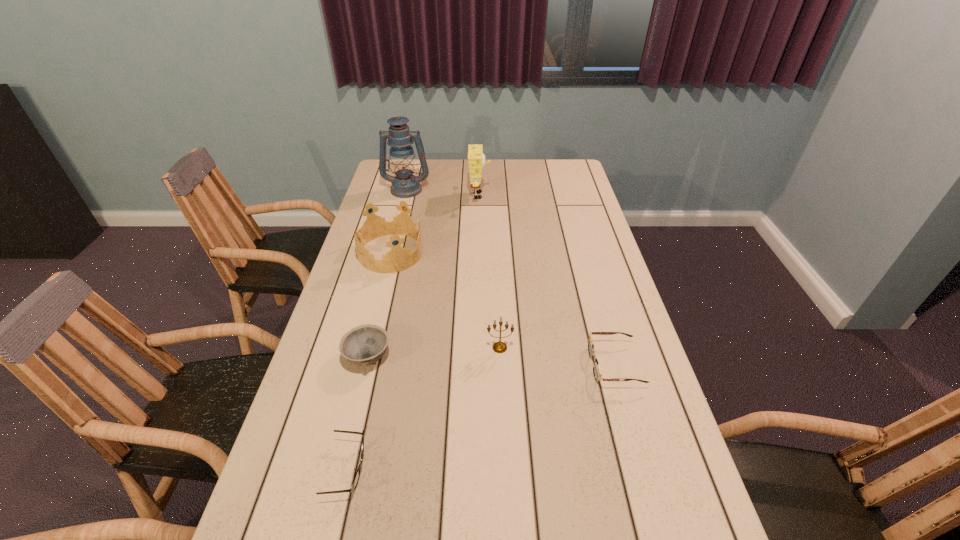
Locate an element on the screen. lantern is located at coordinates (404, 185).

Identify the location of the sixth shortest object. (476, 159).

Locate an element on the screen. The image size is (960, 540). the fifth nearest object is located at coordinates [x=398, y=258].

Locate an element on the screen. The height and width of the screenshot is (540, 960). candelabrum is located at coordinates click(499, 347).

The width and height of the screenshot is (960, 540). What are the coordinates of `the third shortest object` in the screenshot? It's located at (363, 345).

This screenshot has width=960, height=540. Find the location of `the rightmost object`. the rightmost object is located at coordinates (596, 369).

The image size is (960, 540). I want to click on the right spectacles, so click(x=596, y=369).

Where is `the nearest object`? The width and height of the screenshot is (960, 540). the nearest object is located at coordinates (x=356, y=479).

At what (x,y) coordinates should I click in order to perform the action: click on the left spectacles. Please return your answer as a coordinate pair (x, y). The height and width of the screenshot is (540, 960). Looking at the image, I should click on (356, 479).

At what (x,y) coordinates should I click in order to perform the action: click on vacant space located on the front-facing side of the tallest object. Please return your answer as a coordinate pair (x, y). Looking at the image, I should click on (393, 247).